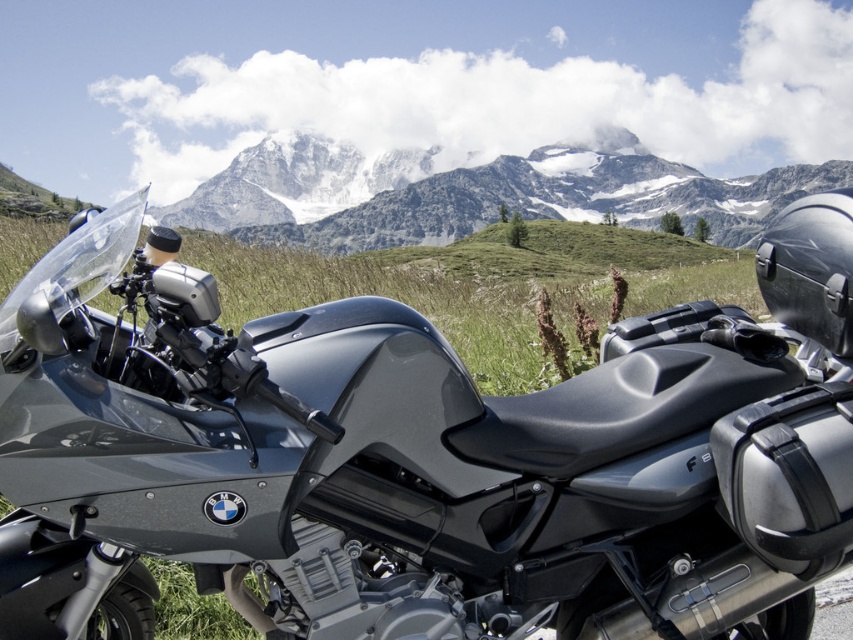
Which is in front, point (613, 321) or point (637, 220)?

Point (613, 321) is in front.

Is point (840, 428) positioned after point (250, 221)?

That is False.

Is point (706, 600) more distant than point (527, 176)?

No.

Where is `matte black motorcycle at lower left`? The height and width of the screenshot is (640, 853). matte black motorcycle at lower left is located at coordinates (421, 458).